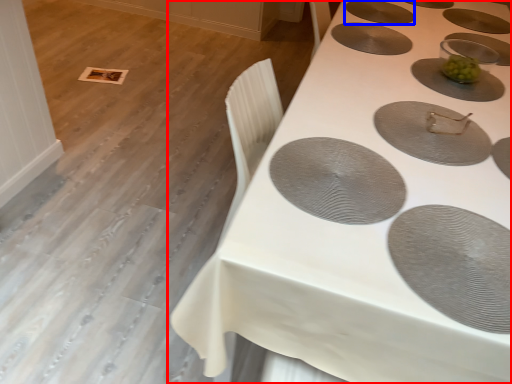
Question: Which point is closer to the camera, table (highlighted by a red box) or oval (highlighted by a blue box)?

Choices:
 (A) table
 (B) oval

Answer: (A)